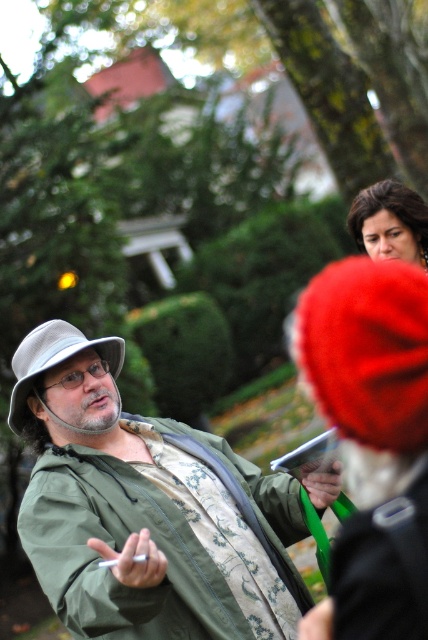
Is point (128, 566) farther from camera compared to point (324, 301)?

Yes, it is behind point (324, 301).

The width and height of the screenshot is (428, 640). What do you see at coordinates (143, 508) in the screenshot? I see `green matte jacket at center` at bounding box center [143, 508].

Identify the location of green matte jacket at center. Image resolution: width=428 pixels, height=640 pixels. (143, 508).

Does green matte jacket at center have a larger size compared to gray fabric hat at left?

Correct, green matte jacket at center is larger in size than gray fabric hat at left.

Who is more distant from viewer, (74, 596) or (104, 355)?

Positioned behind is point (104, 355).

Who is more forward, (189, 561) or (51, 356)?

Point (189, 561) is in front.

You are a GUI agent. You are given a task and a screenshot of the screen. Output one action in this format:
    pyautogui.click(x=<x>, y=<y>)
    Task: Click on the green matte jacket at center
    
    Given the screenshot: What is the action you would take?
    pyautogui.click(x=143, y=508)

Who is more forward, (x=376, y=326) or (x=20, y=346)?

Point (x=376, y=326) is more forward.

Which of these two, red fuzzy christmas hat at upper right or gray fabric hat at left, stands taller?

With more height is red fuzzy christmas hat at upper right.

What do you see at coordinates (366, 349) in the screenshot?
I see `red fuzzy christmas hat at upper right` at bounding box center [366, 349].

Find the location of `red fuzzy christmas hat at upper right`. red fuzzy christmas hat at upper right is located at coordinates (366, 349).